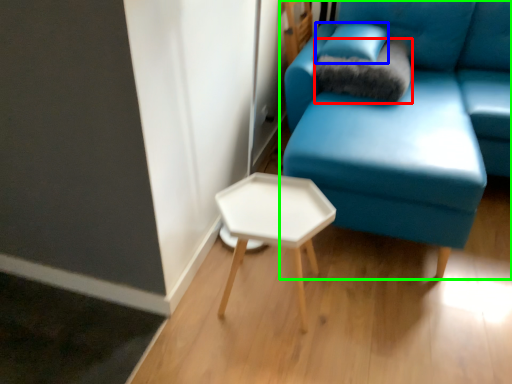
Question: Estimate the real-world distances between objects in this image. Which object is closer to pillow (highlighted by a red box), pillow (highlighted by a blue box) or studio couch (highlighted by a green box)?

Choices:
 (A) pillow
 (B) studio couch

Answer: (A)